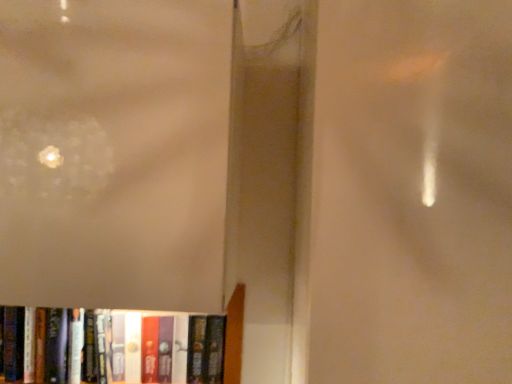
Locate an element on the screen. hardcover books at lower left is located at coordinates pos(132,347).

What is the approximate width of hardcover books at lower left?

hardcover books at lower left is 6.80 inches wide.

This screenshot has height=384, width=512. What do you see at coordinates (132, 347) in the screenshot?
I see `hardcover books at lower left` at bounding box center [132, 347].

I want to click on hardcover books at lower left, so click(x=132, y=347).